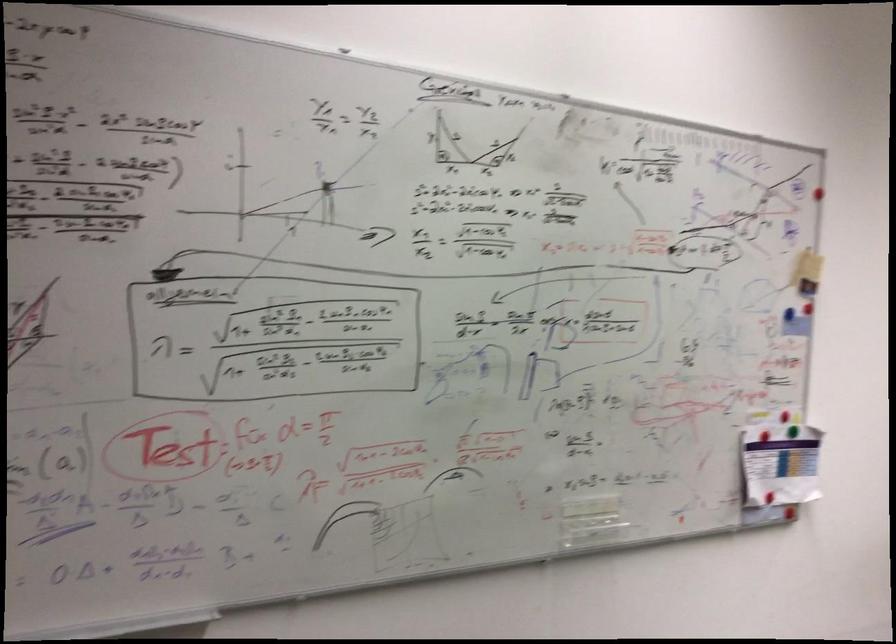
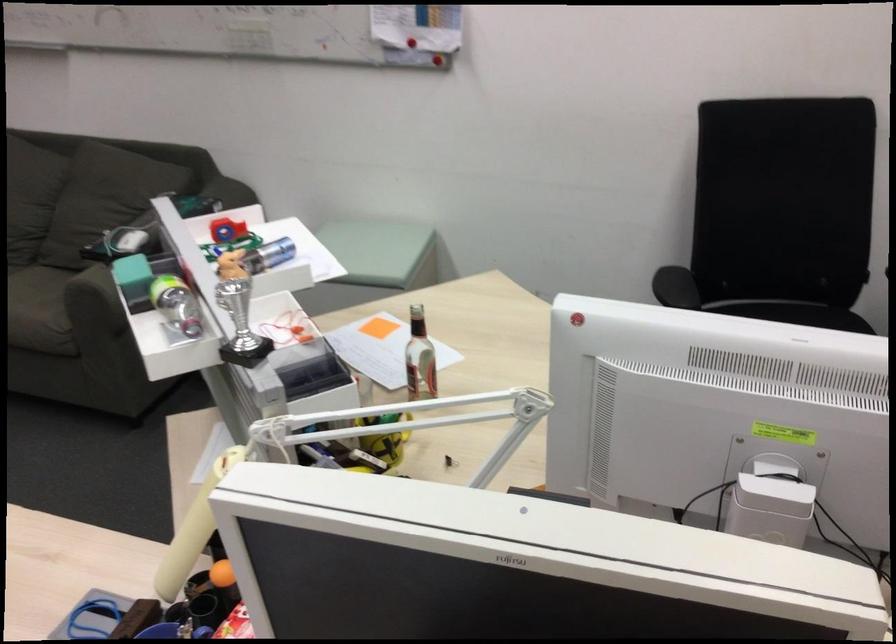
In the second image, find the point that corresponds to point 752,460 in the first image.

(401, 13)